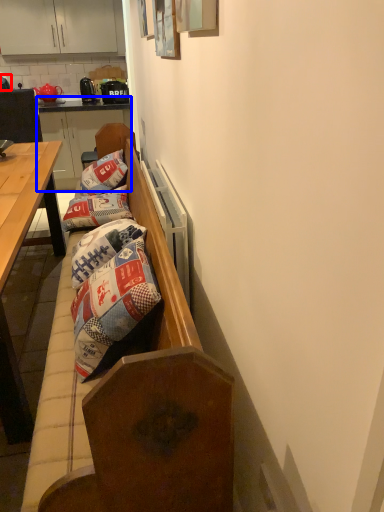
Question: Which of the following is the closest to the observer, coffee cup (highlighted by a red box) or dresser (highlighted by a blue box)?

Choices:
 (A) coffee cup
 (B) dresser

Answer: (A)